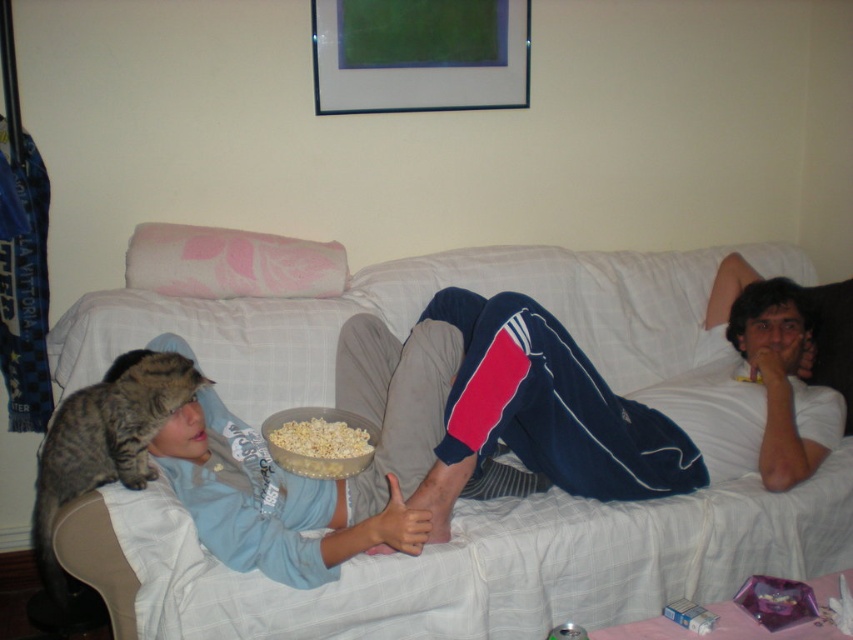
Question: From the image, what is the correct spatial relationship of white fabric couch at center in relation to tabby fur cat at left?

Choices:
 (A) right
 (B) left

Answer: (A)

Question: Which object is positioned farthest from the white popcorn at center?

Choices:
 (A) white fabric couch at center
 (B) blue track pants at center
 (C) tabby fur cat at left

Answer: (A)

Question: Is white fabric couch at center thinner than tabby fur cat at left?

Choices:
 (A) no
 (B) yes

Answer: (A)

Question: Is white fabric couch at center below blue track pants at center?

Choices:
 (A) no
 (B) yes

Answer: (A)

Question: Which of these objects is positioned closest to the white fabric couch at center?

Choices:
 (A) white popcorn at center
 (B) tabby fur cat at left

Answer: (A)

Question: Estimate the real-world distances between objects in this image. Which object is farther from the tabby fur cat at left?

Choices:
 (A) blue track pants at center
 (B) white fabric couch at center

Answer: (A)